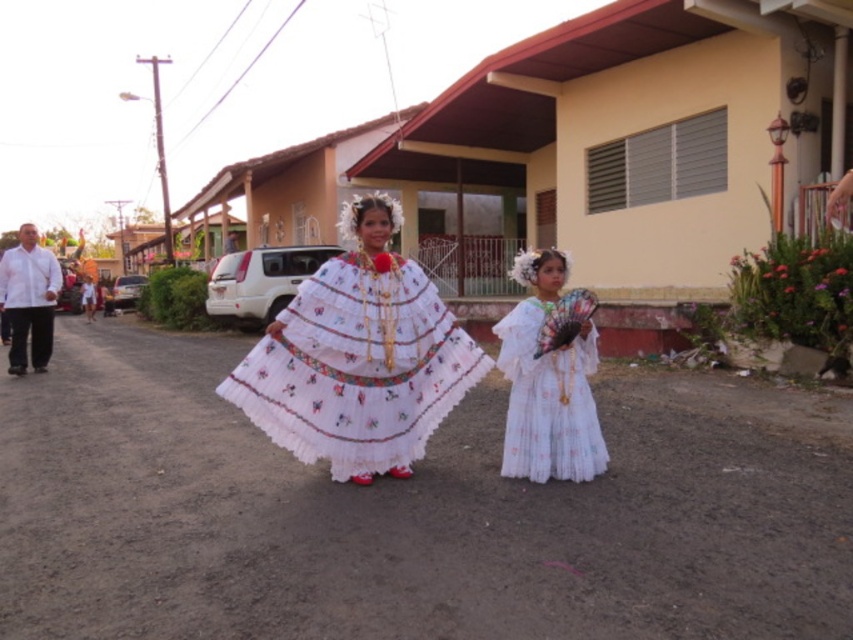
Question: Is white embroidered dress at center bigger than white cotton dress at center?

Choices:
 (A) no
 (B) yes

Answer: (B)

Question: Does white embroidered dress at center have a smaller size compared to white cotton dress at center?

Choices:
 (A) yes
 (B) no

Answer: (B)

Question: Which object is closer to the camera taking this photo?

Choices:
 (A) white cotton dress at center
 (B) white embroidered dress at center

Answer: (B)

Question: Can you confirm if white embroidered dress at center is thinner than white cotton dress at center?

Choices:
 (A) no
 (B) yes

Answer: (A)

Question: Which object appears closest to the camera in this image?

Choices:
 (A) white cotton dress at center
 (B) white embroidered dress at center

Answer: (B)